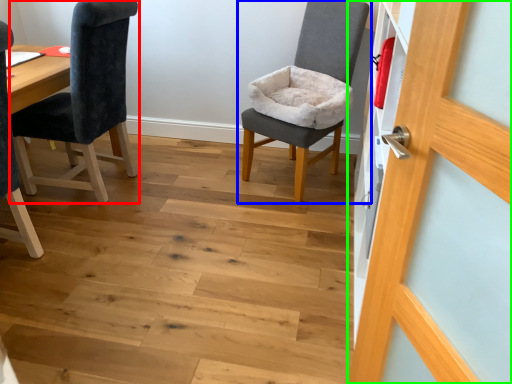
Question: Estimate the real-world distances between objects in this image. Which object is farther from chair (highlighted by a red box), chair (highlighted by a blue box) or door (highlighted by a green box)?

Choices:
 (A) chair
 (B) door

Answer: (B)